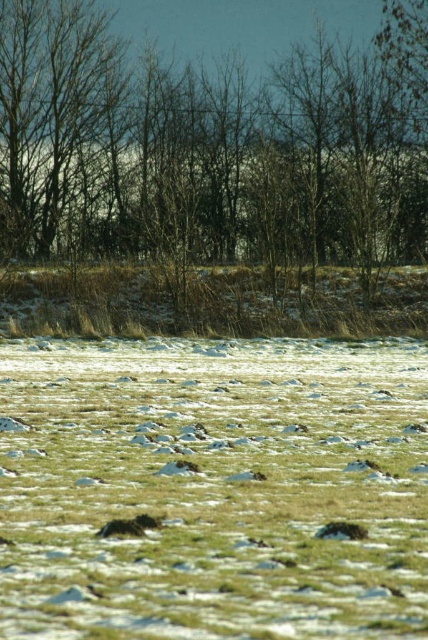
Which is above, brown leafless tree at center or dry grass at center?

Positioned higher is brown leafless tree at center.

Does point (258, 244) come farther from viewer compared to point (336, 316)?

Yes, it is.

Where is `brown leafless tree at center`? The width and height of the screenshot is (428, 640). brown leafless tree at center is located at coordinates (211, 150).

Identify the location of brown leafless tree at center. (211, 150).